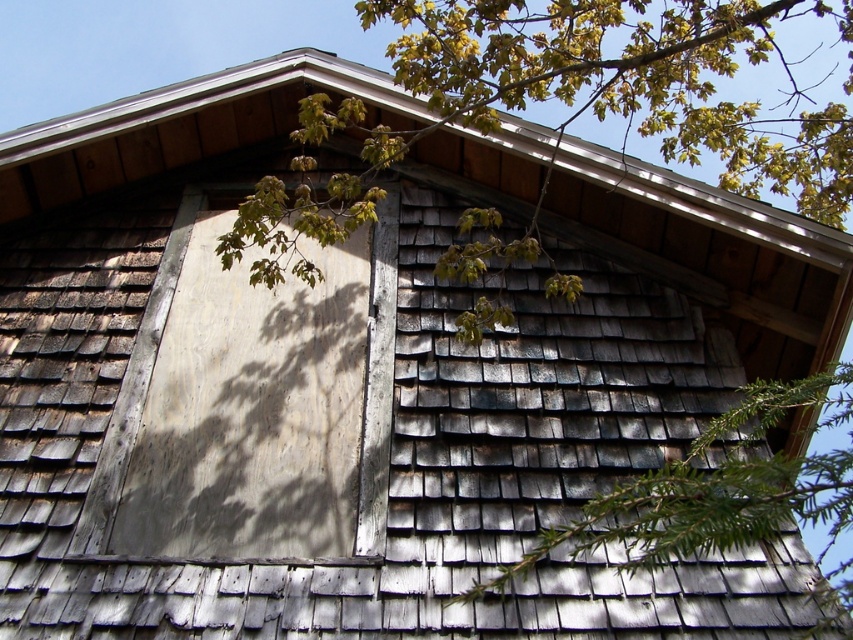
You are a painter planning to paint the white wood board at center and the green textured pine branch at center. Which object requires more paint due to its larger width?

The white wood board at center requires more paint because its width is larger than the green textured pine branch at center.

You are standing in front of the wooden building and want to reach the white wood board at center. Based on its position, which direction should you move relative to your current position?

The white wood board at center is located at point coordinates, so you should move towards the center of the building to reach it.